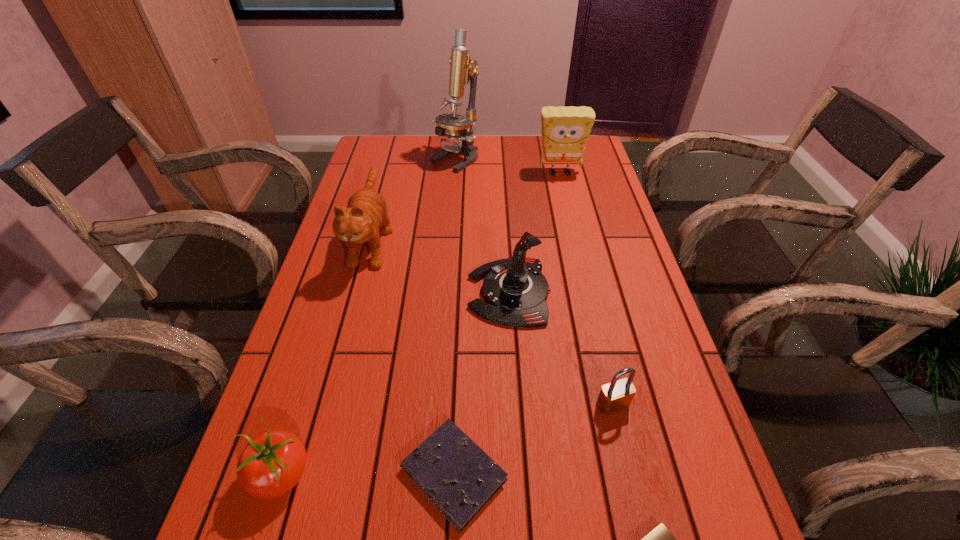
The height and width of the screenshot is (540, 960). What are the coordinates of `vacant space located 0.400m on the face of the cat` in the screenshot? It's located at (319, 440).

Locate an element on the screen. vacant area situated 0.350m on the handle side of the joystick is located at coordinates (323, 293).

Locate an element on the screen. blank space located 0.160m on the handle side of the joystick is located at coordinates (401, 293).

At what (x,y) coordinates should I click in order to perform the action: click on blank space located on the handle side of the joystick. Please return your answer as a coordinate pair (x, y). Looking at the image, I should click on (444, 293).

Find the location of a particular element. vacant space located 0.220m on the back of the fourth nearest object is located at coordinates (590, 309).

Locate an element on the screen. The height and width of the screenshot is (540, 960). vacant space situated 0.200m on the right of the tomato is located at coordinates (428, 474).

Find the location of a particular element. The width and height of the screenshot is (960, 540). free spot located on the right of the diary is located at coordinates (588, 475).

Identify the location of microscope at the far edge. (453, 126).

You are a GUI agent. You are given a task and a screenshot of the screen. Output one action in this format:
    pyautogui.click(x=<x>, y=<y>)
    Task: Click on the sponge present at the far edge
    This screenshot has width=960, height=540.
    Given the screenshot: What is the action you would take?
    pyautogui.click(x=565, y=131)

Where is `cat situated at the left edge`? The image size is (960, 540). cat situated at the left edge is located at coordinates (366, 214).